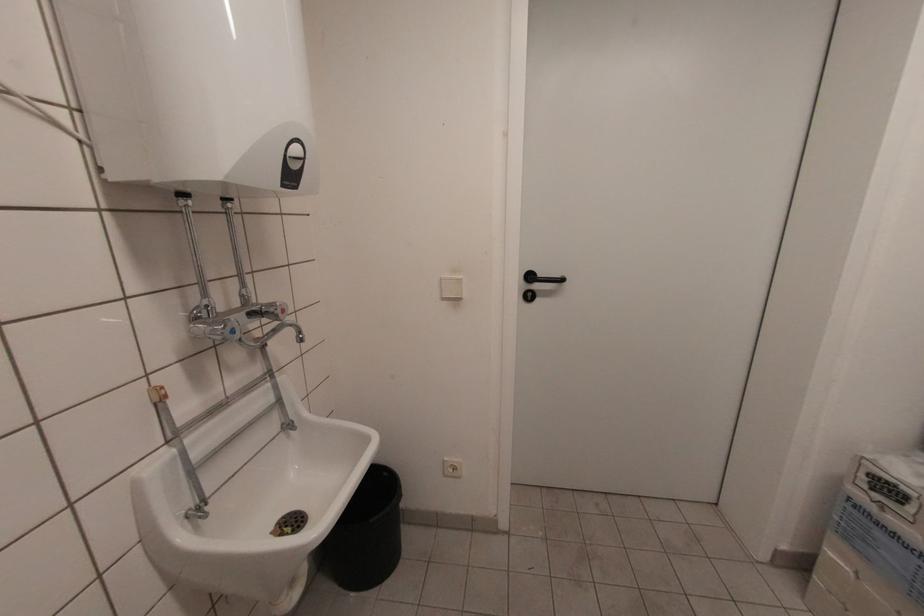
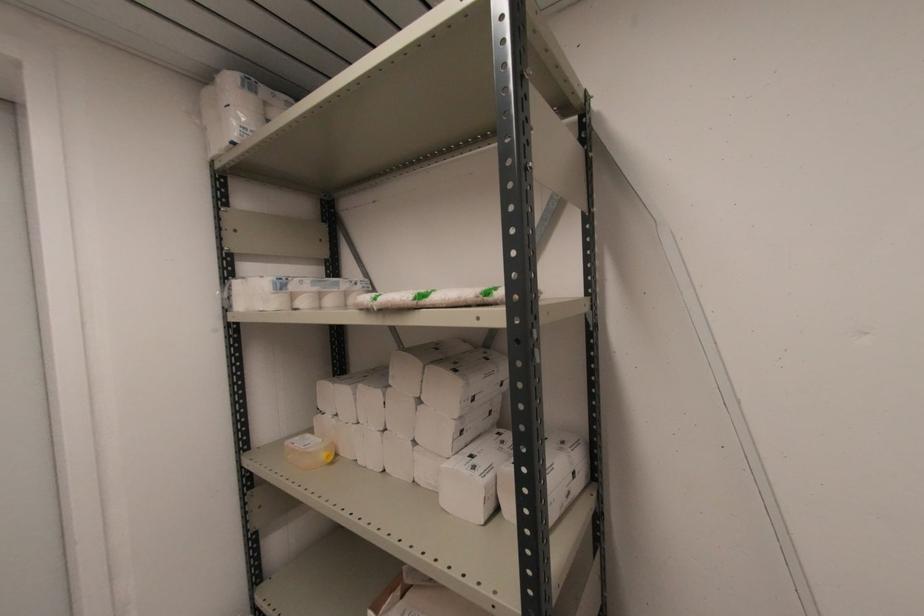
Question: How did the camera likely rotate?

Choices:
 (A) Left
 (B) Right
 (C) Up
 (D) Down

Answer: (B)